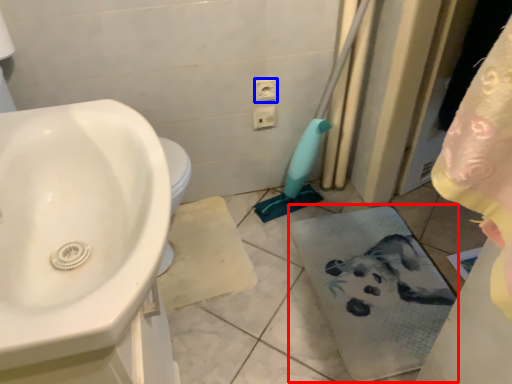
Question: Which point is closer to the camera, bath towel (highlighted by a red box) or electric outlet (highlighted by a blue box)?

Choices:
 (A) bath towel
 (B) electric outlet

Answer: (A)